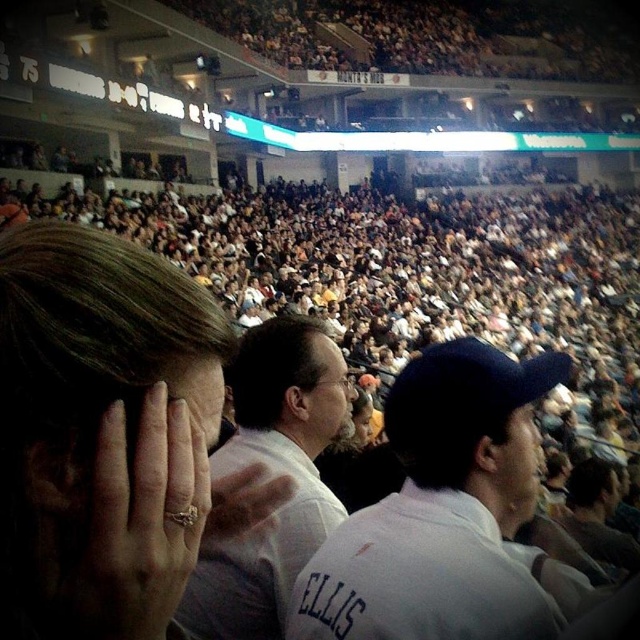
You are a photographer standing at the front row of the arena. You want to take a photo of the crowd while ensuring the matte gold ring at center is visible in the frame. Based on its position, where should you aim your camera?

The matte gold ring at center is located at coordinates point (108, 435), so you should aim your camera towards the lower right area of the scene to capture it.

You are a photographer trying to capture a clear shot of the white cotton shirt at center and the white shirt at center. Which one is positioned lower in the image?

The white cotton shirt at center is located below the white shirt at center, so it is positioned lower in the image.